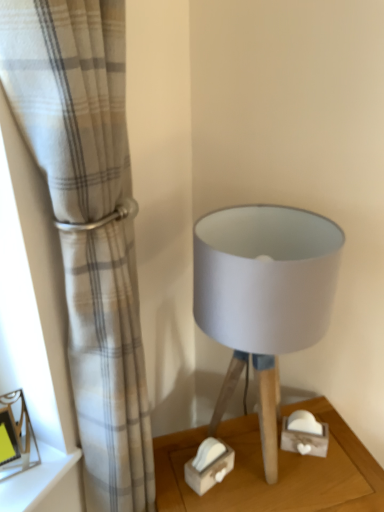
Find the location of a particular element. vacant location behind wooden tissue box at lower center is located at coordinates (215, 434).